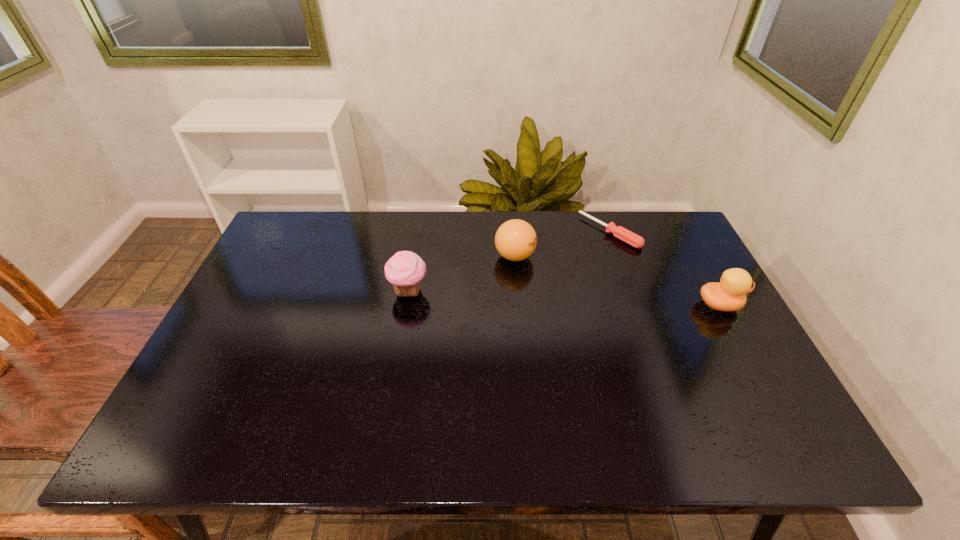
The height and width of the screenshot is (540, 960). Find the location of `cupcake`. cupcake is located at coordinates (405, 270).

You are a GUI agent. You are given a task and a screenshot of the screen. Output one action in this format:
    pyautogui.click(x=<x>, y=<y>)
    Task: Click on the duckling
    The width and height of the screenshot is (960, 540).
    Given the screenshot: What is the action you would take?
    pyautogui.click(x=730, y=294)

Where is `ping-pong ball`? ping-pong ball is located at coordinates (515, 240).

Find the location of a particular element. The image size is (960, 540). the shortest object is located at coordinates (619, 232).

Where is `the second object from right to left`? This screenshot has width=960, height=540. the second object from right to left is located at coordinates (619, 232).

Image resolution: width=960 pixels, height=540 pixels. I want to click on vacant space located on the front of the cupcake, so click(x=392, y=393).

Locate an element on the screen. This screenshot has width=960, height=540. vacant space located 0.250m on the side with brand of the ping-pong ball is located at coordinates (600, 308).

I want to click on vacant point located 0.340m on the side with brand of the ping-pong ball, so click(630, 325).

Identify the location of free space located on the side with brand of the ping-pong ball. The width and height of the screenshot is (960, 540). point(546,275).

Locate an element on the screen. free spot located at the tip of the third object from left to right is located at coordinates (573, 258).